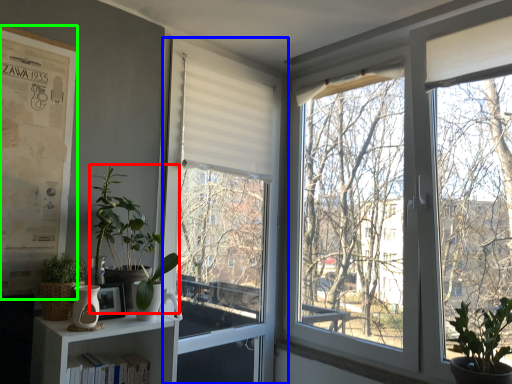
Question: Considering the real-world distances, which object is closest to vegetation (highlighted by a red box)? window (highlighted by a blue box) or bulletin board (highlighted by a green box).

Choices:
 (A) window
 (B) bulletin board

Answer: (B)